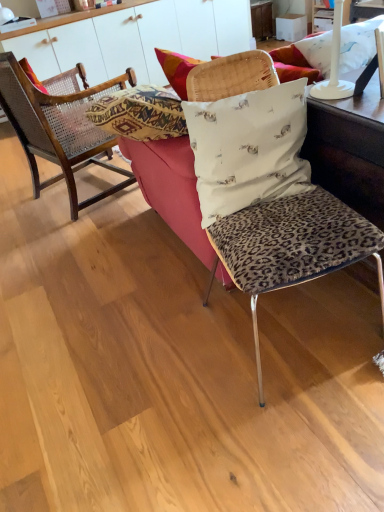
Question: Is white glossy cabinet at upper center shorter than leopard print fabric couch at center?

Choices:
 (A) yes
 (B) no

Answer: (B)

Question: Is leopard print fabric couch at center at the back of white glossy cabinet at upper center?

Choices:
 (A) no
 (B) yes

Answer: (A)

Question: Is white glossy cabinet at upper center thinner than leopard print fabric couch at center?

Choices:
 (A) yes
 (B) no

Answer: (A)

Question: Is the depth of white glossy cabinet at upper center greater than that of leopard print fabric couch at center?

Choices:
 (A) no
 (B) yes

Answer: (B)

Question: Can you confirm if white glossy cabinet at upper center is positioned to the right of leopard print fabric couch at center?

Choices:
 (A) no
 (B) yes

Answer: (A)

Question: Is leopard print fabric couch at center inside the boundaries of wooden cane chair at left, the 1th chair in the left-to-right sequence, or outside?

Choices:
 (A) outside
 (B) inside

Answer: (A)

Question: Is leopard print fabric couch at center wider or thinner than wooden cane chair at left, the 1th chair in the left-to-right sequence?

Choices:
 (A) thin
 (B) wide

Answer: (B)

Question: Is leopard print fabric couch at center to the left or to the right of wooden cane chair at left, positioned as the second chair in right-to-left order, in the image?

Choices:
 (A) left
 (B) right

Answer: (B)

Question: From a real-world perspective, is leopard print fabric couch at center positioned above or below wooden cane chair at left, positioned as the second chair in right-to-left order?

Choices:
 (A) above
 (B) below

Answer: (B)

Question: Looking at their shapes, would you say leopard print cushion at center, the second chair from the left, is wider or thinner than white glossy cabinet at upper center?

Choices:
 (A) wide
 (B) thin

Answer: (B)

Question: Is point (218, 240) closer or farther from the camera than point (185, 32)?

Choices:
 (A) farther
 (B) closer

Answer: (B)

Question: Which is correct: leopard print cushion at center, the 1th chair viewed from the right, is inside white glossy cabinet at upper center, or outside of it?

Choices:
 (A) outside
 (B) inside

Answer: (A)

Question: From a real-world perspective, relative to white glossy cabinet at upper center, is leopard print cushion at center, the 1th chair positioned from the front, vertically above or below?

Choices:
 (A) below
 (B) above

Answer: (B)

Question: Is white fabric pillow with small animal prints at center, marked as the 1th pillow in a bottom-to-top arrangement, wider or thinner than woven cane pillow at left, which is the 1th pillow in left-to-right order?

Choices:
 (A) wide
 (B) thin

Answer: (A)

Question: Looking at the image, does white fabric pillow with small animal prints at center, marked as the 1th pillow in a bottom-to-top arrangement, seem bigger or smaller compared to woven cane pillow at left, which is the 1th pillow in left-to-right order?

Choices:
 (A) big
 (B) small

Answer: (B)